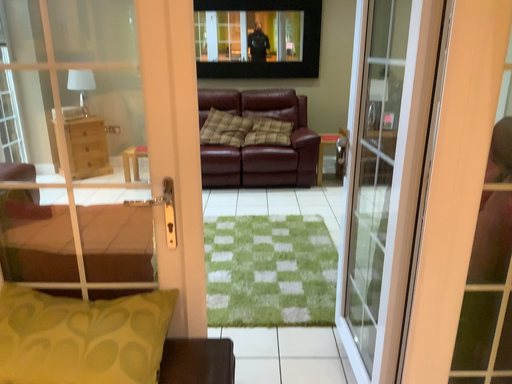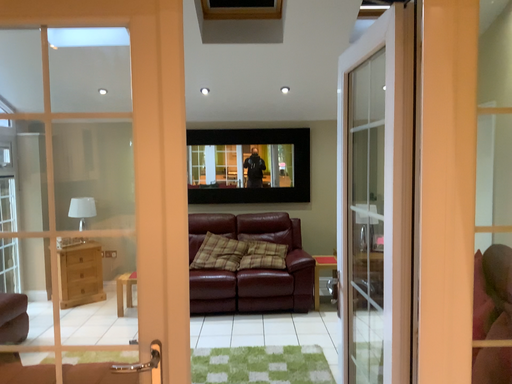
Question: How did the camera likely rotate when shooting the video?

Choices:
 (A) rotated upward
 (B) rotated downward

Answer: (A)